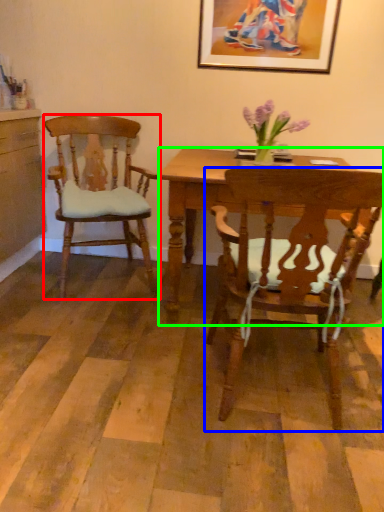
Question: Which object is positioned farthest from chair (highlighted by a red box)? Select from chair (highlighted by a blue box) and desk (highlighted by a green box).

Choices:
 (A) chair
 (B) desk

Answer: (A)